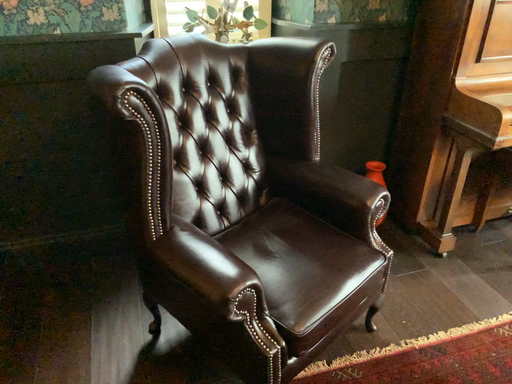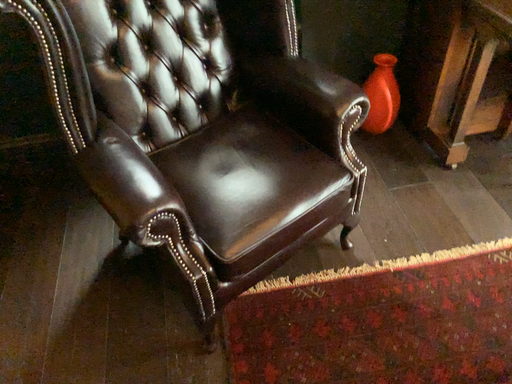
Question: How did the camera likely rotate when shooting the video?

Choices:
 (A) rotated upward
 (B) rotated downward

Answer: (B)